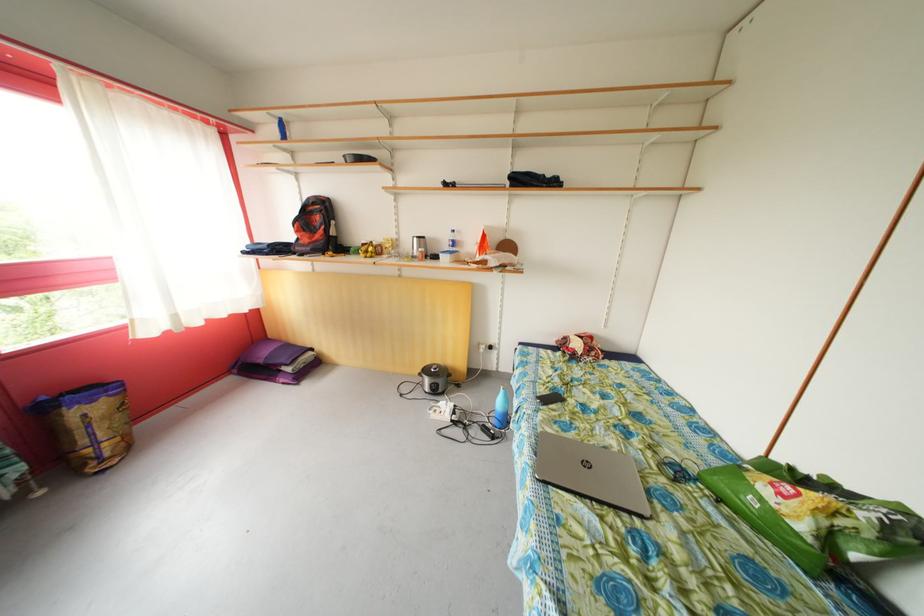
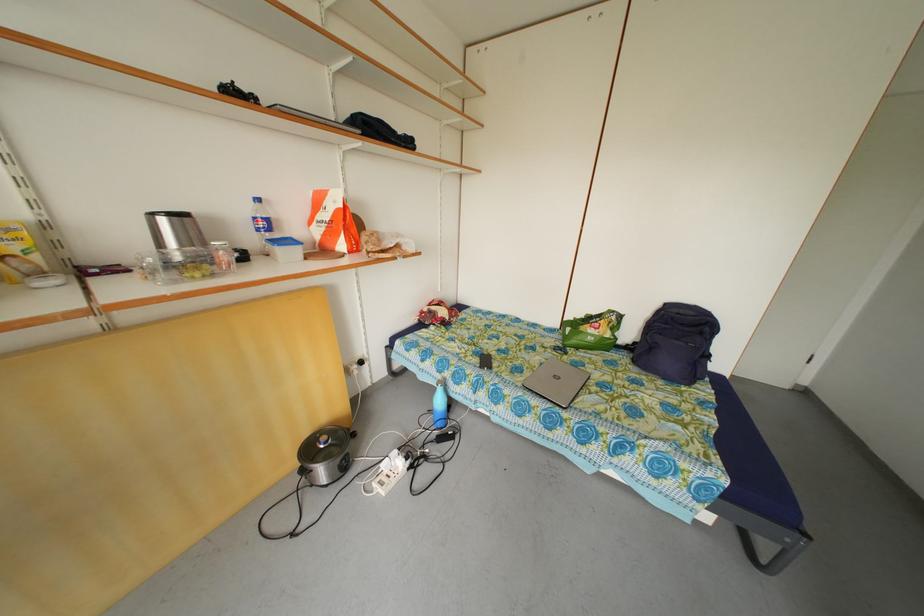
The point at (586,440) is marked in the first image. Where is the corresponding point in the second image?

(535, 374)